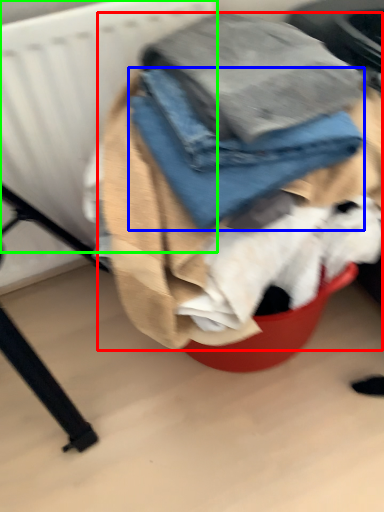
Question: Which object is the farthest from laundry (highlighted by a red box)? Choose among these: trousers (highlighted by a blue box) or radiator (highlighted by a green box).

Choices:
 (A) trousers
 (B) radiator

Answer: (B)